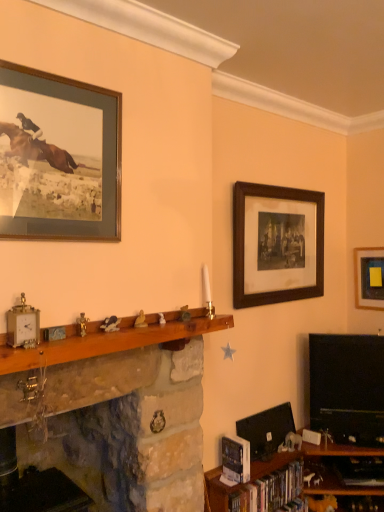
Question: Is wooden mantle at center, acting as the 1th shelf starting from the left, at the back of wooden framed print at upper right, positioned as the 2th picture frame in left-to-right order?

Choices:
 (A) no
 (B) yes

Answer: (A)

Question: Is wooden framed print at upper right, positioned as the 2th picture frame in left-to-right order, taller than wooden mantle at center, which is the 3th shelf from right to left?

Choices:
 (A) no
 (B) yes

Answer: (A)

Question: Is the depth of wooden framed print at upper right, positioned as the 2th picture frame in left-to-right order, greater than that of wooden mantle at center, acting as the 1th shelf starting from the left?

Choices:
 (A) yes
 (B) no

Answer: (A)

Question: From a real-world perspective, is wooden framed print at upper right, positioned as the 2th picture frame in left-to-right order, positioned under wooden mantle at center, acting as the 1th shelf starting from the left, based on gravity?

Choices:
 (A) yes
 (B) no

Answer: (B)

Question: From the image's perspective, does wooden framed print at upper right, which appears as the second picture frame when viewed from the front, appear lower than wooden mantle at center, acting as the 1th shelf starting from the left?

Choices:
 (A) yes
 (B) no

Answer: (B)

Question: From the image's perspective, is wooden framed print at upper right, positioned as the 2th picture frame in left-to-right order, located above wooden mantle at center, acting as the 1th shelf starting from the left?

Choices:
 (A) no
 (B) yes

Answer: (B)

Question: From the image's perspective, does black glossy television at right appear lower than wooden framed print at upper left, positioned as the 3th picture frame in back-to-front order?

Choices:
 (A) no
 (B) yes

Answer: (B)

Question: Considering the relative sizes of black glossy television at right and wooden framed print at upper left, acting as the third picture frame starting from the right, in the image provided, is black glossy television at right thinner than wooden framed print at upper left, acting as the third picture frame starting from the right,?

Choices:
 (A) yes
 (B) no

Answer: (B)

Question: Is the position of black glossy television at right more distant than that of wooden framed print at upper left, which is the 1th picture frame from left to right?

Choices:
 (A) no
 (B) yes

Answer: (B)

Question: Can you confirm if black glossy television at right is taller than wooden framed print at upper left, which is the 1th picture frame from left to right?

Choices:
 (A) yes
 (B) no

Answer: (A)

Question: Is black glossy television at right touching wooden framed print at upper left, the first picture frame from the front?

Choices:
 (A) yes
 (B) no

Answer: (B)

Question: Is wooden framed print at upper left, positioned as the 3th picture frame in back-to-front order, a part of black glossy television at right?

Choices:
 (A) no
 (B) yes

Answer: (A)

Question: Is hardcover books at lower right with wooden shelf at lower right, which is counted as the 1th shelf, starting from the right?

Choices:
 (A) yes
 (B) no

Answer: (A)